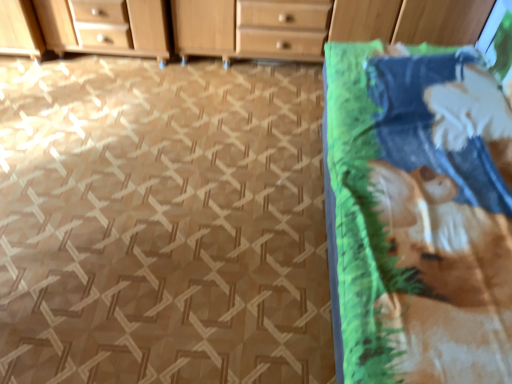
Question: Considering the relative sizes of green fabric at right and printed cotton blanket at right in the image provided, is green fabric at right thinner than printed cotton blanket at right?

Choices:
 (A) yes
 (B) no

Answer: (B)

Question: From a real-world perspective, is green fabric at right located higher than printed cotton blanket at right?

Choices:
 (A) no
 (B) yes

Answer: (A)

Question: Considering the relative positions of green fabric at right and printed cotton blanket at right in the image provided, is green fabric at right to the left of printed cotton blanket at right from the viewer's perspective?

Choices:
 (A) yes
 (B) no

Answer: (A)

Question: Is green fabric at right aimed at printed cotton blanket at right?

Choices:
 (A) no
 (B) yes

Answer: (A)

Question: Is green fabric at right to the right of printed cotton blanket at right from the viewer's perspective?

Choices:
 (A) no
 (B) yes

Answer: (A)

Question: Is the depth of green fabric at right greater than that of printed cotton blanket at right?

Choices:
 (A) yes
 (B) no

Answer: (A)

Question: Is wooden chest of drawers at upper center far from printed cotton blanket at right?

Choices:
 (A) no
 (B) yes

Answer: (A)

Question: From the image's perspective, is wooden chest of drawers at upper center on printed cotton blanket at right?

Choices:
 (A) yes
 (B) no

Answer: (A)

Question: Does wooden chest of drawers at upper center have a larger size compared to printed cotton blanket at right?

Choices:
 (A) no
 (B) yes

Answer: (A)

Question: Considering the relative sizes of wooden chest of drawers at upper center and printed cotton blanket at right in the image provided, is wooden chest of drawers at upper center taller than printed cotton blanket at right?

Choices:
 (A) no
 (B) yes

Answer: (A)

Question: Can printed cotton blanket at right be found inside wooden chest of drawers at upper center?

Choices:
 (A) no
 (B) yes

Answer: (A)

Question: Considering the relative positions of wooden chest of drawers at upper center and printed cotton blanket at right in the image provided, is wooden chest of drawers at upper center to the right of printed cotton blanket at right from the viewer's perspective?

Choices:
 (A) yes
 (B) no

Answer: (B)

Question: Does printed cotton blanket at right have a lesser width compared to green fabric at right?

Choices:
 (A) yes
 (B) no

Answer: (A)